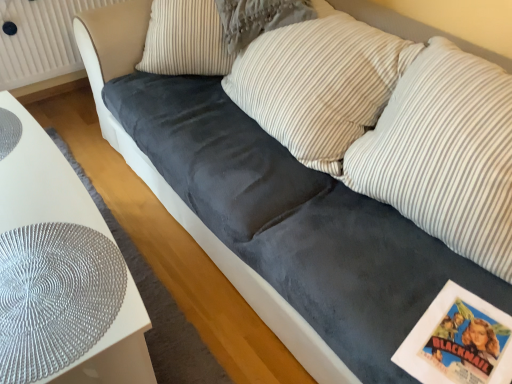
Question: Which direction should I rotate to face striped fabric pillow at center, placed as the 3th pillow when sorted from right to left, — up or down?

Choices:
 (A) down
 (B) up

Answer: (B)

Question: Could you tell me if white glossy table at lower left is turned towards velvet gray pillow at center, placed as the first pillow when sorted from left to right?

Choices:
 (A) yes
 (B) no

Answer: (B)

Question: Is white glossy table at lower left closer to camera compared to velvet gray pillow at center, placed as the first pillow when sorted from left to right?

Choices:
 (A) yes
 (B) no

Answer: (A)

Question: Are white glossy table at lower left and velvet gray pillow at center, which is the 4th pillow from right to left, located far from each other?

Choices:
 (A) yes
 (B) no

Answer: (B)

Question: Does white glossy table at lower left appear on the left side of velvet gray pillow at center, placed as the first pillow when sorted from left to right?

Choices:
 (A) yes
 (B) no

Answer: (A)

Question: Is the position of white glossy table at lower left more distant than that of velvet gray pillow at center, which is the 4th pillow from right to left?

Choices:
 (A) yes
 (B) no

Answer: (B)

Question: Considering the relative sizes of white glossy table at lower left and velvet gray pillow at center, placed as the first pillow when sorted from left to right, in the image provided, is white glossy table at lower left bigger than velvet gray pillow at center, placed as the first pillow when sorted from left to right,?

Choices:
 (A) no
 (B) yes

Answer: (B)

Question: Is striped fabric pillow at center, arranged as the fourth pillow when viewed from the left, smaller than white striped pillow at center, acting as the 3th pillow starting from the left?

Choices:
 (A) no
 (B) yes

Answer: (B)

Question: Considering the relative sizes of striped fabric pillow at center, which is counted as the first pillow, starting from the right, and white striped pillow at center, acting as the 3th pillow starting from the left, in the image provided, is striped fabric pillow at center, which is counted as the first pillow, starting from the right, wider than white striped pillow at center, acting as the 3th pillow starting from the left,?

Choices:
 (A) yes
 (B) no

Answer: (A)

Question: Would you consider striped fabric pillow at center, which is counted as the first pillow, starting from the right, to be distant from white striped pillow at center, positioned as the second pillow in right-to-left order?

Choices:
 (A) yes
 (B) no

Answer: (B)

Question: Could you tell me if striped fabric pillow at center, which is counted as the first pillow, starting from the right, is turned towards white striped pillow at center, acting as the 3th pillow starting from the left?

Choices:
 (A) no
 (B) yes

Answer: (A)

Question: Is striped fabric pillow at center, which is counted as the first pillow, starting from the right, to the left of white striped pillow at center, positioned as the second pillow in right-to-left order, from the viewer's perspective?

Choices:
 (A) no
 (B) yes

Answer: (A)

Question: From a real-world perspective, is striped fabric pillow at center, which is counted as the first pillow, starting from the right, on white striped pillow at center, acting as the 3th pillow starting from the left?

Choices:
 (A) no
 (B) yes

Answer: (B)

Question: Considering the relative positions of white textured radiator at upper left and striped fabric pillow at center, the 2th pillow when ordered from left to right, in the image provided, is white textured radiator at upper left to the right of striped fabric pillow at center, the 2th pillow when ordered from left to right, from the viewer's perspective?

Choices:
 (A) yes
 (B) no

Answer: (B)